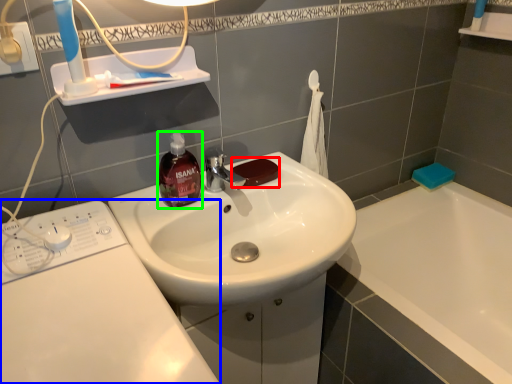
Question: Considering the real-world distances, which object is closest to soap (highlighted by a red box)? washing machine (highlighted by a blue box) or soap dispenser (highlighted by a green box).

Choices:
 (A) washing machine
 (B) soap dispenser

Answer: (B)